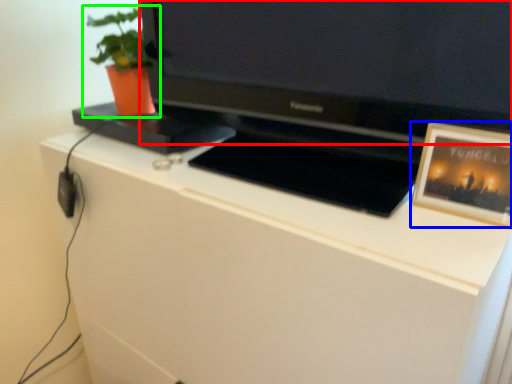
Question: Based on their relative distances, which object is farther from television (highlighted by a red box)? Choose from picture frame (highlighted by a blue box) and houseplant (highlighted by a green box).

Choices:
 (A) picture frame
 (B) houseplant

Answer: (B)